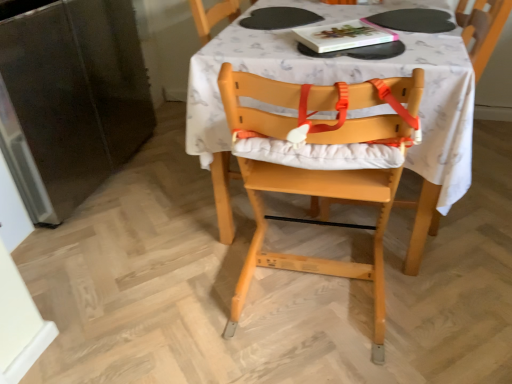
Question: From the image's perspective, is white fabric table at center over natural wood highchair at center?

Choices:
 (A) yes
 (B) no

Answer: (A)

Question: Could you tell me if white fabric table at center is turned towards natural wood highchair at center?

Choices:
 (A) no
 (B) yes

Answer: (B)

Question: Considering the relative sizes of white fabric table at center and natural wood highchair at center in the image provided, is white fabric table at center smaller than natural wood highchair at center?

Choices:
 (A) yes
 (B) no

Answer: (B)

Question: From a real-world perspective, is white fabric table at center positioned under natural wood highchair at center based on gravity?

Choices:
 (A) yes
 (B) no

Answer: (A)

Question: Does white fabric table at center have a larger size compared to natural wood highchair at center?

Choices:
 (A) yes
 (B) no

Answer: (A)

Question: Considering the positions of point (194, 71) and point (336, 23), is point (194, 71) closer or farther from the camera than point (336, 23)?

Choices:
 (A) closer
 (B) farther

Answer: (A)

Question: Based on their positions, is white fabric table at center located to the left or right of hardcover book at upper center?

Choices:
 (A) left
 (B) right

Answer: (B)

Question: Is white fabric table at center bigger or smaller than hardcover book at upper center?

Choices:
 (A) small
 (B) big

Answer: (B)

Question: Considering the positions of white fabric table at center and hardcover book at upper center in the image, is white fabric table at center wider or thinner than hardcover book at upper center?

Choices:
 (A) wide
 (B) thin

Answer: (A)

Question: In the image, is natural wood highchair at center on the left side or the right side of hardcover book at upper center?

Choices:
 (A) left
 (B) right

Answer: (A)

Question: From the image's perspective, is natural wood highchair at center above or below hardcover book at upper center?

Choices:
 (A) below
 (B) above

Answer: (A)

Question: Looking at their shapes, would you say natural wood highchair at center is wider or thinner than hardcover book at upper center?

Choices:
 (A) wide
 (B) thin

Answer: (A)

Question: Is point (375, 134) positioned closer to the camera than point (342, 49)?

Choices:
 (A) farther
 (B) closer

Answer: (B)

Question: Do you think white fabric table at center is within natural wood highchair at center, or outside of it?

Choices:
 (A) outside
 (B) inside

Answer: (A)

Question: Considering the positions of white fabric table at center and natural wood highchair at center in the image, is white fabric table at center taller or shorter than natural wood highchair at center?

Choices:
 (A) tall
 (B) short

Answer: (B)